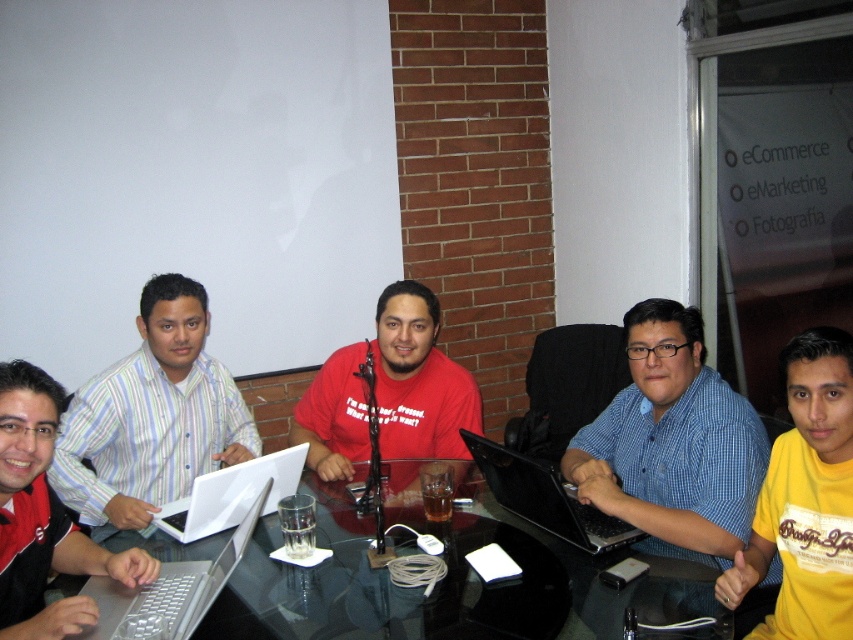
Question: Which of the following is the farthest from the observer?

Choices:
 (A) yellow cotton shirt at lower right
 (B) white matte laptop at center
 (C) striped cotton shirt at left

Answer: (C)

Question: Which of the following is the farthest from the observer?

Choices:
 (A) (100, 506)
 (B) (409, 424)

Answer: (B)

Question: Is black glass table at center wider than striped cotton shirt at left?

Choices:
 (A) yes
 (B) no

Answer: (A)

Question: Estimate the real-world distances between objects in this image. Which object is farther from the black glossy laptop at center?

Choices:
 (A) matte red shirt at center
 (B) black glass table at center
 (C) blue checkered shirt at center
 (D) yellow cotton shirt at lower right

Answer: (A)

Question: Does striped cotton shirt at left appear under black glossy laptop at center?

Choices:
 (A) yes
 (B) no

Answer: (B)

Question: Is yellow cotton shirt at lower right bigger than white matte laptop at center?

Choices:
 (A) yes
 (B) no

Answer: (A)